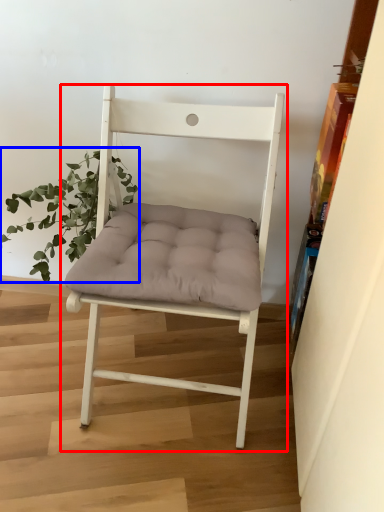
Question: Which point is further to the camera, chair (highlighted by a red box) or houseplant (highlighted by a blue box)?

Choices:
 (A) chair
 (B) houseplant

Answer: (B)